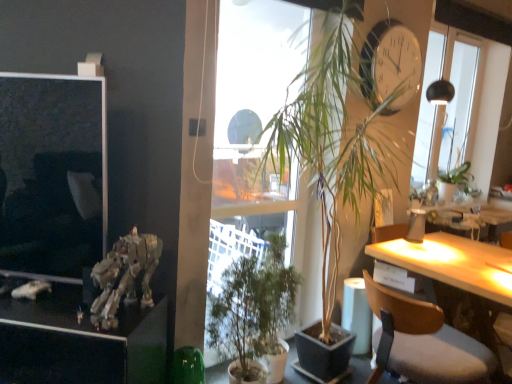
Question: Is the depth of metallic gold skeleton at lower left greater than that of wooden chair at right?

Choices:
 (A) yes
 (B) no

Answer: (B)

Question: Does metallic gold skeleton at lower left appear on the right side of wooden chair at right?

Choices:
 (A) yes
 (B) no

Answer: (B)

Question: From a real-world perspective, does metallic gold skeleton at lower left stand above wooden chair at right?

Choices:
 (A) no
 (B) yes

Answer: (B)

Question: Is metallic gold skeleton at lower left wider than wooden chair at right?

Choices:
 (A) no
 (B) yes

Answer: (A)

Question: Considering the relative sizes of metallic gold skeleton at lower left and wooden chair at right in the image provided, is metallic gold skeleton at lower left shorter than wooden chair at right?

Choices:
 (A) yes
 (B) no

Answer: (A)

Question: In terms of size, does green leafy plant at upper right appear bigger or smaller than green matte plant at center, which is the first houseplant in top-to-bottom order?

Choices:
 (A) small
 (B) big

Answer: (A)

Question: Is green leafy plant at upper right in front of or behind green matte plant at center, which is the first houseplant in top-to-bottom order, in the image?

Choices:
 (A) front
 (B) behind

Answer: (B)

Question: Considering the positions of point (466, 183) and point (378, 41), is point (466, 183) closer or farther from the camera than point (378, 41)?

Choices:
 (A) farther
 (B) closer

Answer: (A)

Question: In the image, is green leafy plant at upper right on the left side or the right side of green matte plant at center, which is the first houseplant in top-to-bottom order?

Choices:
 (A) left
 (B) right

Answer: (B)

Question: From a real-world perspective, is transparent glass window at upper right physically located above or below wooden chair at right?

Choices:
 (A) below
 (B) above

Answer: (B)

Question: Considering the positions of transparent glass window at upper right and wooden chair at right in the image, is transparent glass window at upper right taller or shorter than wooden chair at right?

Choices:
 (A) tall
 (B) short

Answer: (A)

Question: Choose the correct answer: Is transparent glass window at upper right inside wooden chair at right or outside it?

Choices:
 (A) outside
 (B) inside

Answer: (A)

Question: Is point (488, 165) positioned closer to the camera than point (470, 377)?

Choices:
 (A) farther
 (B) closer

Answer: (A)

Question: In the image, is metallic silver robot at left on the left side or the right side of wooden chair at right?

Choices:
 (A) left
 (B) right

Answer: (A)

Question: Considering the positions of point (46, 342) and point (375, 289), is point (46, 342) closer or farther from the camera than point (375, 289)?

Choices:
 (A) closer
 (B) farther

Answer: (A)